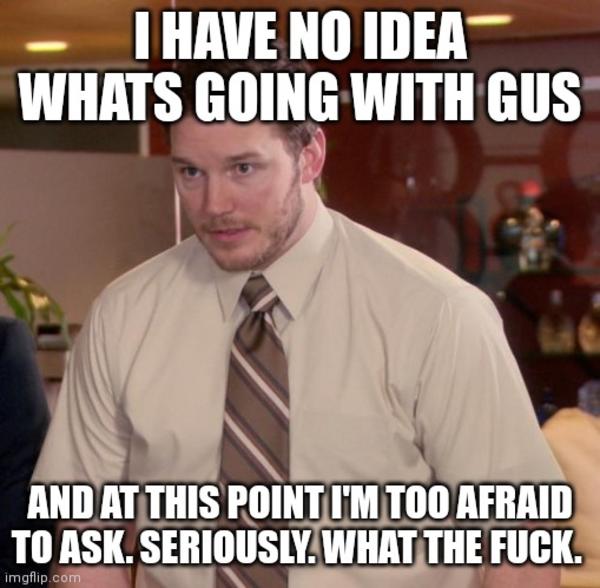
Where is `beige wall`? beige wall is located at coordinates (75, 193), (75, 283).